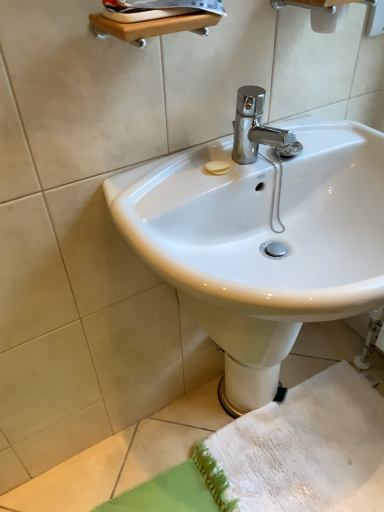
This screenshot has width=384, height=512. I want to click on free space to the left of white glossy bidet at lower center, so tap(193, 414).